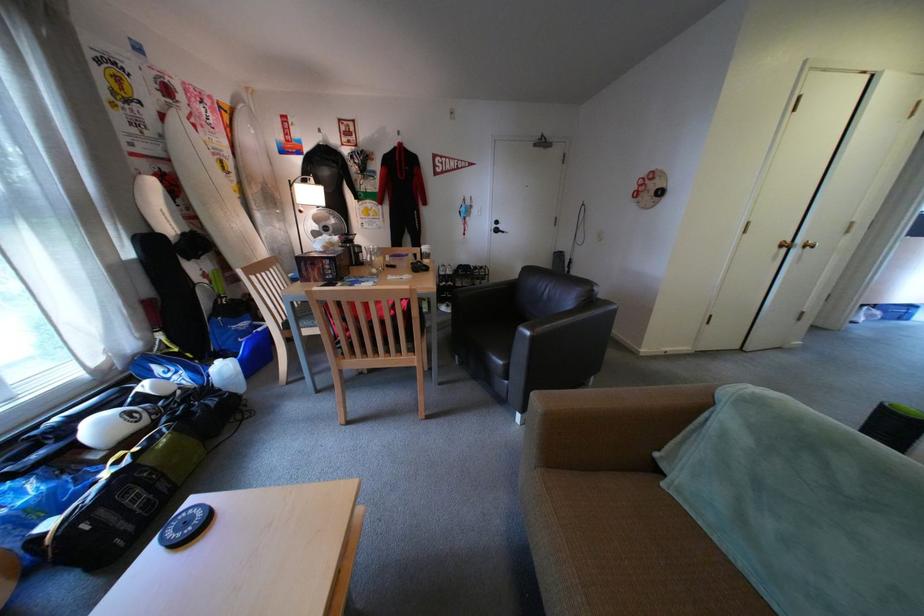
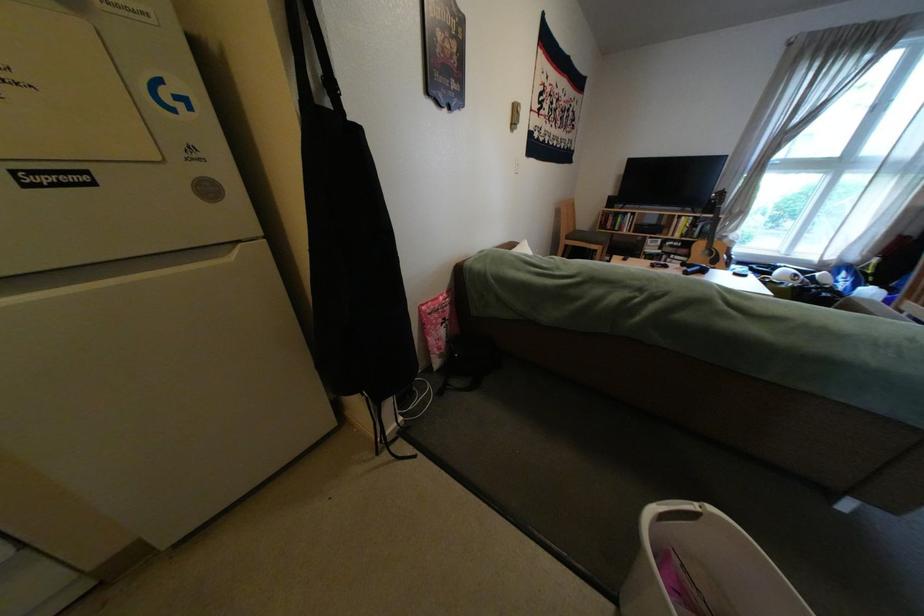
Question: I am providing you with two images of the same scene from different viewpoints. After the viewpoint changes to image2, which objects are now occluded?

Choices:
 (A) white water jug
 (B) gray file drawer
 (C) black bag strap
 (D) black remote control

Answer: (A)